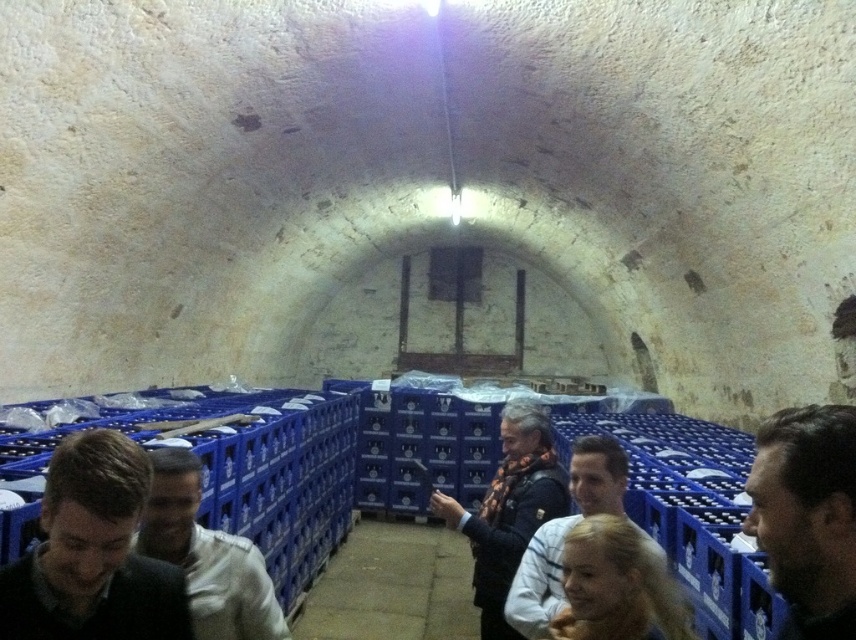
You are standing in the wine cellar and want to reach both points. Which point, point (227, 545) or point (599, 502), is closer to you?

Point (227, 545) is closer to you than point (599, 502).

You are a visitor in the wine cellar and see a person with dark brown hair at right and a white matte shirt at lower left. Which object is located more to the right side?

The dark brown hair at right is more to the right side than the white matte shirt at lower left.

You are a visitor in the wine cellar and you see a person with dark brown hair at right and a white matte shirt at lower left. Which part of the person is higher?

The dark brown hair at right is located above the white matte shirt at lower left, so the dark brown hair at right is higher.